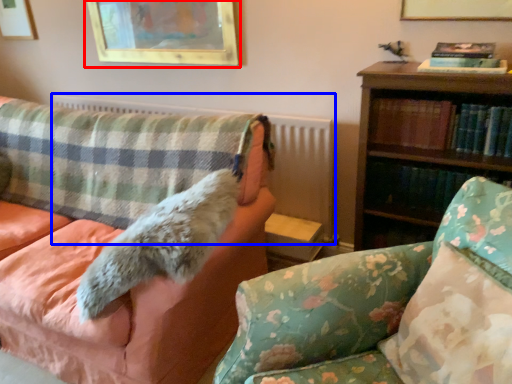
Question: Which of the following is the farthest to the observer, picture frame (highlighted by a red box) or radiator (highlighted by a blue box)?

Choices:
 (A) picture frame
 (B) radiator

Answer: (A)